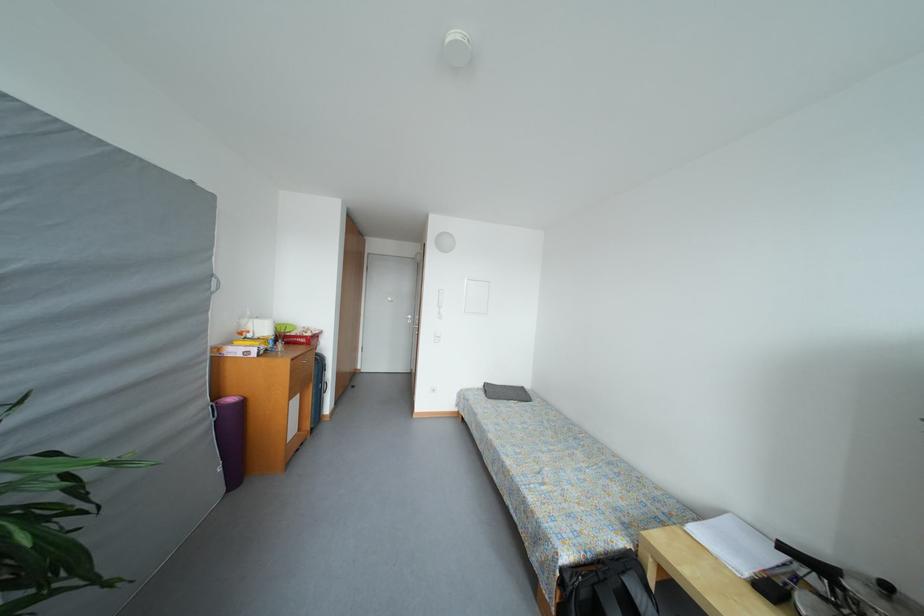
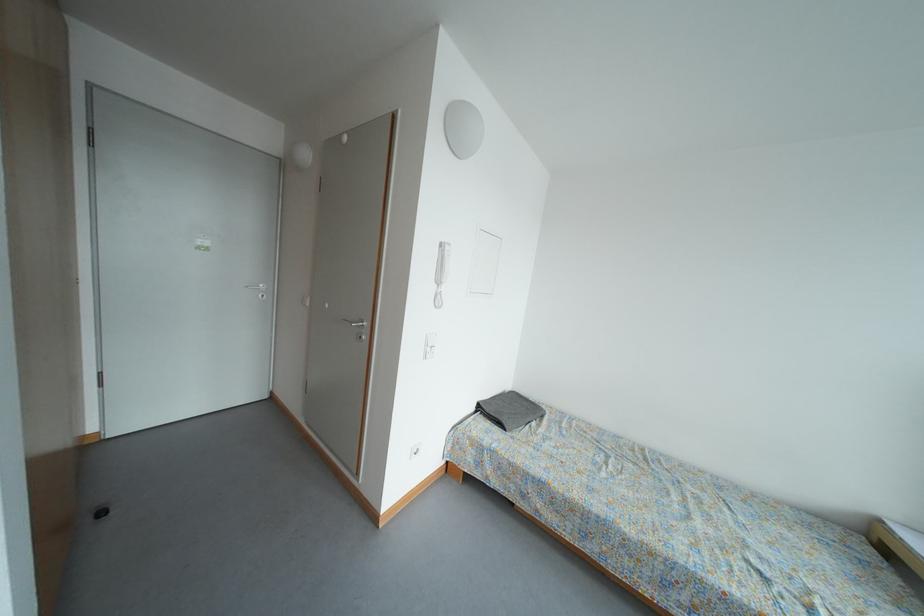
In the second image, find the point that corresponds to (x=492, y=391) in the first image.

(485, 411)